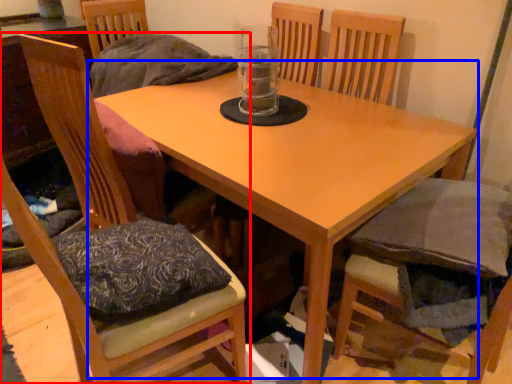
Question: Which of the following is the closest to the observer, chair (highlighted by a red box) or table (highlighted by a blue box)?

Choices:
 (A) chair
 (B) table

Answer: (A)